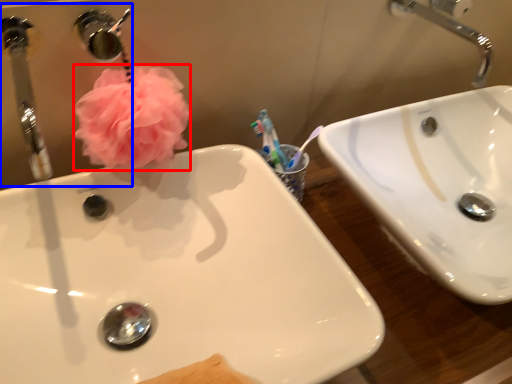
Question: Which object appears closest to the camera in this image, flower (highlighted by a red box) or mirror (highlighted by a blue box)?

Choices:
 (A) flower
 (B) mirror

Answer: (B)